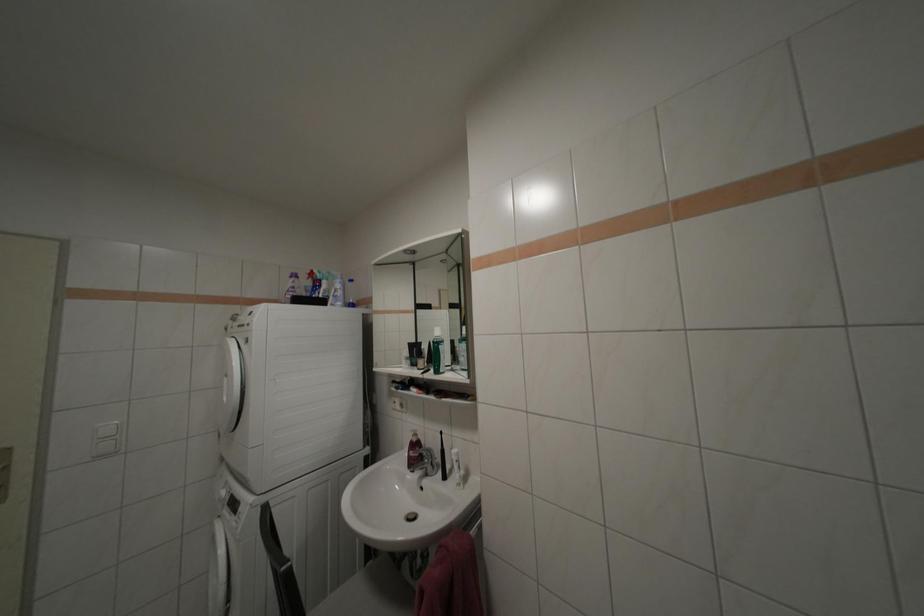
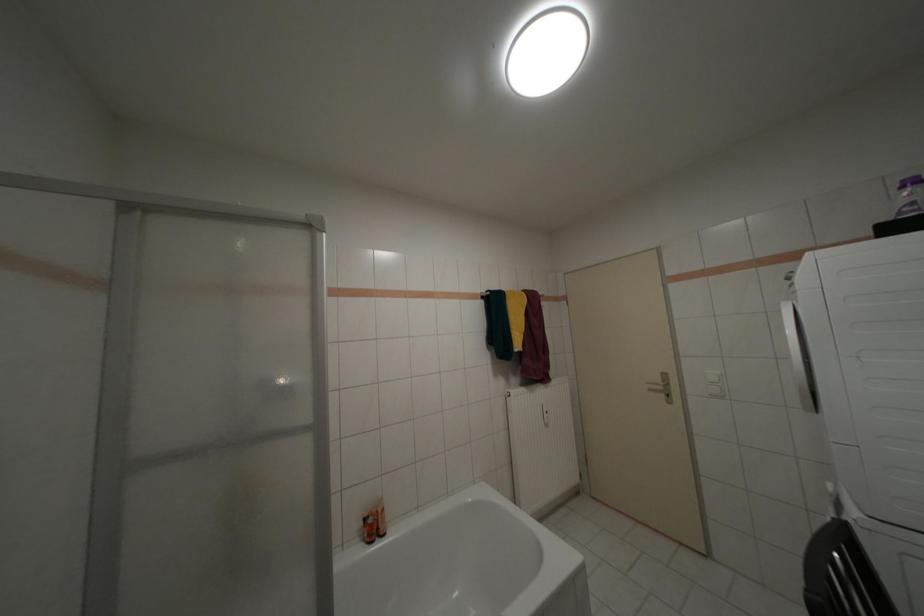
Question: The first image is from the beginning of the video and the second image is from the end. How did the camera likely rotate when shooting the video?

Choices:
 (A) Left
 (B) Right
 (C) Up
 (D) Down

Answer: (A)